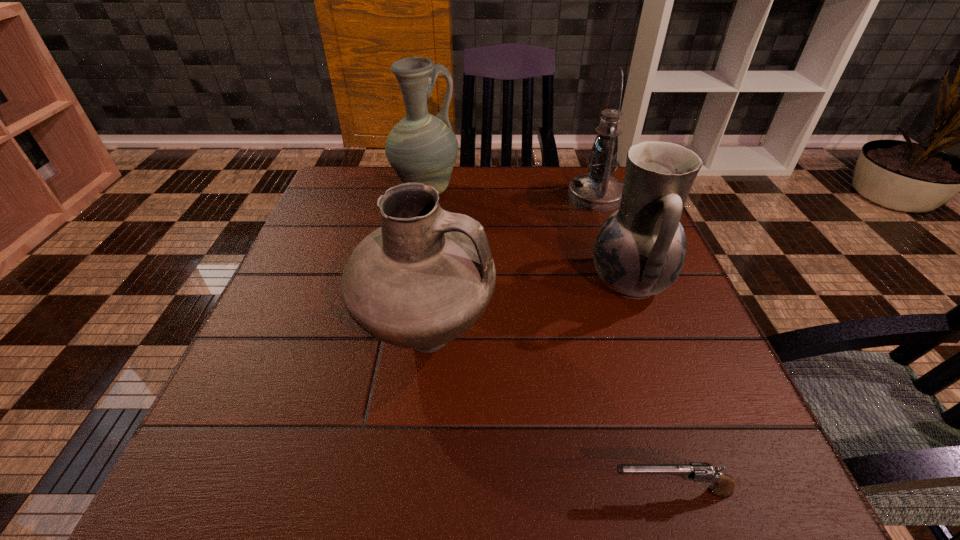
I want to click on the farthest pitcher, so click(x=421, y=148).

I want to click on oil lamp, so click(x=597, y=191).

You are a GUI agent. You are given a task and a screenshot of the screen. Output one action in this format:
    pyautogui.click(x=<x>, y=<y>)
    Task: Click on the rightmost pitcher
    The width and height of the screenshot is (960, 540).
    Given the screenshot: What is the action you would take?
    640,250

I want to click on the shortest object, so click(723, 486).

This screenshot has width=960, height=540. Identify the location of gun. (723, 486).

I want to click on vacant space located 0.100m on the handle side of the farthest pitcher, so click(x=497, y=191).

Where is `vacant space located 0.100m on the left of the oil lamp`? Image resolution: width=960 pixels, height=540 pixels. vacant space located 0.100m on the left of the oil lamp is located at coordinates (530, 196).

Find the location of a particular element. free spot located on the front-facing side of the rightmost pitcher is located at coordinates (564, 282).

At what (x,y) coordinates should I click in order to perform the action: click on vacant space situated on the front-facing side of the rightmost pitcher. Please return your answer as a coordinate pair (x, y). The height and width of the screenshot is (540, 960). Looking at the image, I should click on (425, 282).

Locate an element on the screen. The height and width of the screenshot is (540, 960). vacant space situated 0.290m on the front-facing side of the rightmost pitcher is located at coordinates (449, 282).